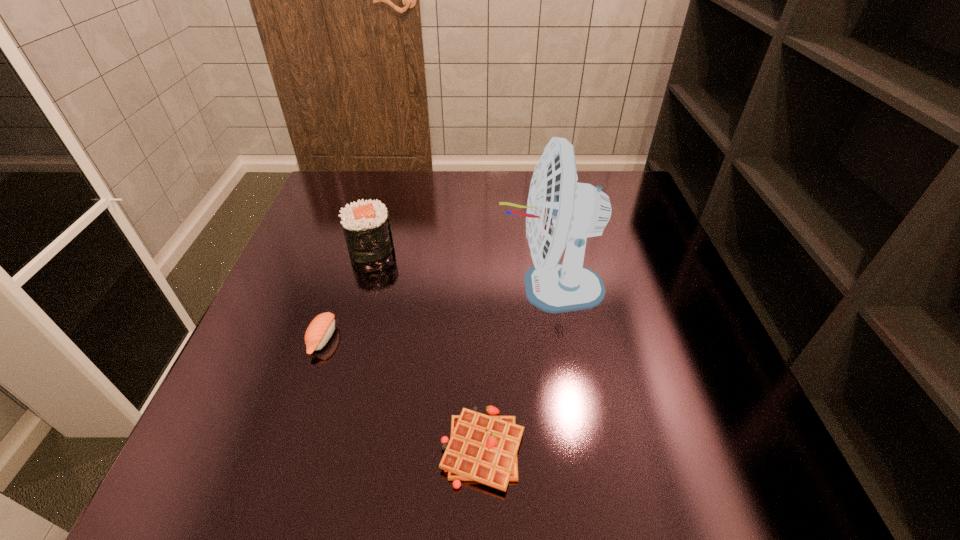
The height and width of the screenshot is (540, 960). I want to click on the tallest object, so click(560, 211).

This screenshot has width=960, height=540. I want to click on the farther sushi, so click(x=366, y=226).

This screenshot has height=540, width=960. In order to click on the third shortest object in this screenshot , I will do `click(366, 226)`.

Where is `the nearer sushi`? the nearer sushi is located at coordinates (320, 330).

Find the location of a particular element. The image size is (960, 540). the shorter sushi is located at coordinates (320, 330).

Identify the location of the nearest object. This screenshot has width=960, height=540. (482, 448).

What are the coordinates of `the shortest object` in the screenshot? It's located at (482, 448).

You are a GUI agent. You are given a task and a screenshot of the screen. Output one action in this format:
    pyautogui.click(x=<x>, y=<y>)
    Task: Click on the vacant space situated 0.310m on the grille of the tallest object
    
    Given the screenshot: What is the action you would take?
    pos(356,287)

Where is `vacant space located on the grille of the tallest object`? This screenshot has width=960, height=540. vacant space located on the grille of the tallest object is located at coordinates (410, 287).

What are the coordinates of `free space located on the grille of the tallest object` in the screenshot? It's located at 450,287.